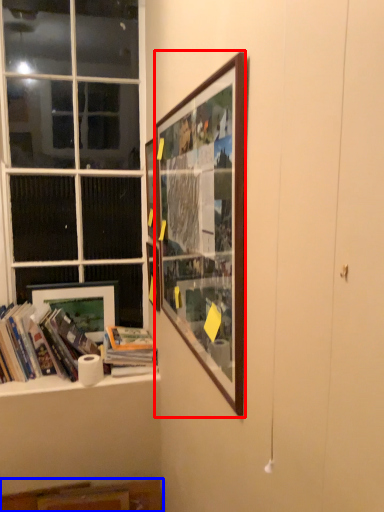
Question: Which object appears closest to the camera in this image, picture frame (highlighted by a red box) or cabinet (highlighted by a blue box)?

Choices:
 (A) picture frame
 (B) cabinet

Answer: (A)